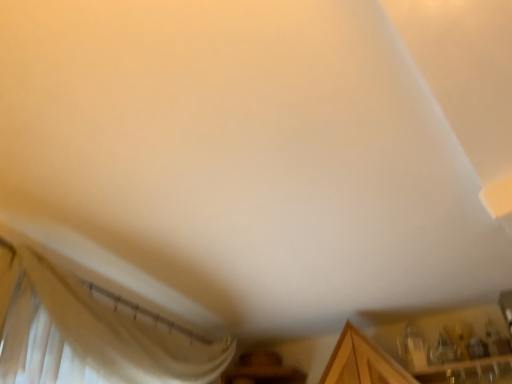
Question: In the image, is wooden cabinet at lower right positioned in front of or behind white sheer curtain at lower left?

Choices:
 (A) front
 (B) behind

Answer: (B)

Question: From their relative heights in the image, would you say wooden cabinet at lower right is taller or shorter than white sheer curtain at lower left?

Choices:
 (A) tall
 (B) short

Answer: (B)

Question: From the image's perspective, is wooden cabinet at lower right located above or below white sheer curtain at lower left?

Choices:
 (A) above
 (B) below

Answer: (B)

Question: Which is correct: white sheer curtain at lower left is inside wooden cabinet at lower right, or outside of it?

Choices:
 (A) outside
 (B) inside

Answer: (A)

Question: Considering the positions of white sheer curtain at lower left and wooden cabinet at lower right in the image, is white sheer curtain at lower left taller or shorter than wooden cabinet at lower right?

Choices:
 (A) short
 (B) tall

Answer: (B)

Question: In terms of width, does white sheer curtain at lower left look wider or thinner when compared to wooden cabinet at lower right?

Choices:
 (A) thin
 (B) wide

Answer: (A)

Question: From a real-world perspective, relative to wooden cabinet at lower right, is white sheer curtain at lower left vertically above or below?

Choices:
 (A) below
 (B) above

Answer: (A)